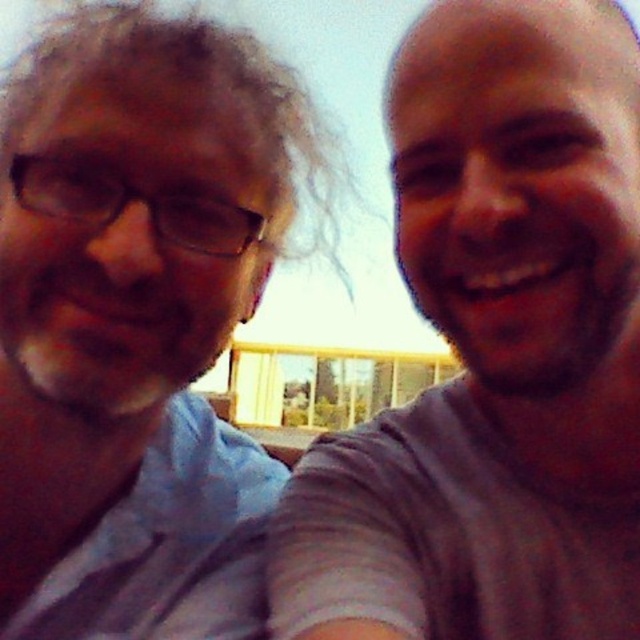
You are trying to determine if the gray cotton shirt at upper right and the matte blue shirt at left can both fit on a rack that is 1 meter wide. Based on their widths, can they fit side by side?

The gray cotton shirt at upper right might be wider than the matte blue shirt at left, so their combined width could exceed 1 meter. It is uncertain if they will fit side by side without overlapping.